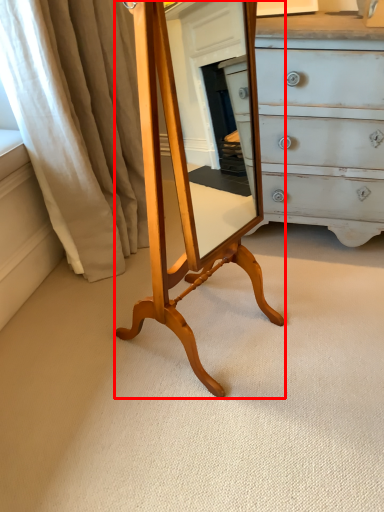
Question: From the image's perspective, what is the correct spatial positioning of table (annotated by the red box) in reference to curtain?

Choices:
 (A) below
 (B) above

Answer: (A)